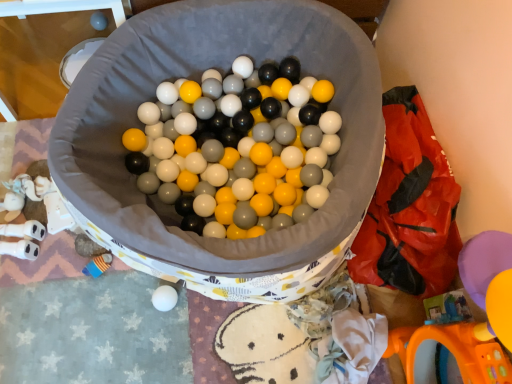
The width and height of the screenshot is (512, 384). Find the location of `matte gray ball at upper left`. matte gray ball at upper left is located at coordinates (99, 21).

What do you see at coordinates (99, 21) in the screenshot? Image resolution: width=512 pixels, height=384 pixels. I see `matte gray ball at upper left` at bounding box center [99, 21].

What is the approximate width of rubberized plastic bag at right?

12.46 inches.

At what (x,y) coordinates should I click in order to perform the action: click on rubberized plastic bag at right. Please return your answer as a coordinate pair (x, y). This screenshot has width=512, height=384. Looking at the image, I should click on (409, 207).

The height and width of the screenshot is (384, 512). What do you see at coordinates (409, 207) in the screenshot?
I see `rubberized plastic bag at right` at bounding box center [409, 207].

This screenshot has width=512, height=384. Find the location of `matte gray ball at upper left`. matte gray ball at upper left is located at coordinates (99, 21).

In the scene shown: Visually, is rubberized plastic bag at right positioned to the left or to the right of matte gray ball at upper left?

rubberized plastic bag at right is to the right of matte gray ball at upper left.

Between rubberized plastic bag at right and matte gray ball at upper left, which one is positioned behind?

matte gray ball at upper left.

Which is behind, point (372, 247) or point (100, 21)?

The point (100, 21) is more distant.

From the image's perspective, who appears lower, rubberized plastic bag at right or matte gray ball at upper left?

rubberized plastic bag at right.

Consider the image. From a real-world perspective, who is located higher, rubberized plastic bag at right or matte gray ball at upper left?

From a 3D spatial view, rubberized plastic bag at right is above.

Looking at their sizes, would you say rubberized plastic bag at right is wider or thinner than matte gray ball at upper left?

rubberized plastic bag at right is wider than matte gray ball at upper left.

Which of these two, rubberized plastic bag at right or matte gray ball at upper left, stands shorter?

Standing shorter between the two is matte gray ball at upper left.

Who is smaller, rubberized plastic bag at right or matte gray ball at upper left?

With smaller size is matte gray ball at upper left.

Is rubberized plastic bag at right not within matte gray ball at upper left?

Yes.

Is rubberized plastic bag at right far away from matte gray ball at upper left?

rubberized plastic bag at right is far away from matte gray ball at upper left.

Is rubberized plastic bag at right turned away from matte gray ball at upper left?

No, rubberized plastic bag at right is not facing away from matte gray ball at upper left.

Where is `toy below the rubberized plastic bag at right (from a real-world perspective)`? This screenshot has height=384, width=512. toy below the rubberized plastic bag at right (from a real-world perspective) is located at coordinates (99, 21).

Considering the relative positions of matte gray ball at upper left and rubberized plastic bag at right in the image provided, is matte gray ball at upper left to the left of rubberized plastic bag at right from the viewer's perspective?

Yes, matte gray ball at upper left is to the left of rubberized plastic bag at right.

Is matte gray ball at upper left positioned behind rubberized plastic bag at right?

Yes.

Which point is more distant from viewer, (91, 17) or (451, 175)?

The point (91, 17) is behind.

From the image's perspective, is matte gray ball at upper left located beneath rubberized plastic bag at right?

No, from the image's perspective, matte gray ball at upper left is not below rubberized plastic bag at right.

From a real-world perspective, is matte gray ball at upper left positioned above or below rubberized plastic bag at right?

In terms of real-world spatial position, matte gray ball at upper left is below rubberized plastic bag at right.

Which object is wider, matte gray ball at upper left or rubberized plastic bag at right?

rubberized plastic bag at right.

Which of these two, matte gray ball at upper left or rubberized plastic bag at right, stands shorter?

matte gray ball at upper left is shorter.

Considering the relative sizes of matte gray ball at upper left and rubberized plastic bag at right in the image provided, is matte gray ball at upper left bigger than rubberized plastic bag at right?

Incorrect, matte gray ball at upper left is not larger than rubberized plastic bag at right.

Is matte gray ball at upper left inside or outside of rubberized plastic bag at right?

matte gray ball at upper left cannot be found inside rubberized plastic bag at right.

From the picture: Are matte gray ball at upper left and rubberized plastic bag at right beside each other?

No, matte gray ball at upper left is not beside rubberized plastic bag at right.

Is matte gray ball at upper left aimed at rubberized plastic bag at right?

No, matte gray ball at upper left is not aimed at rubberized plastic bag at right.

Looking at this image, how different are the orientations of matte gray ball at upper left and rubberized plastic bag at right in degrees?

The angle between the facing direction of matte gray ball at upper left and the facing direction of rubberized plastic bag at right is 88.8 degrees.

Find the location of a particular element. The width and height of the screenshot is (512, 384). material in front of the matte gray ball at upper left is located at coordinates (409, 207).

Where is `material on the right of matte gray ball at upper left`? material on the right of matte gray ball at upper left is located at coordinates (409, 207).

In order to click on material lying below the matte gray ball at upper left (from the image's perspective) in this screenshot , I will do `click(409, 207)`.